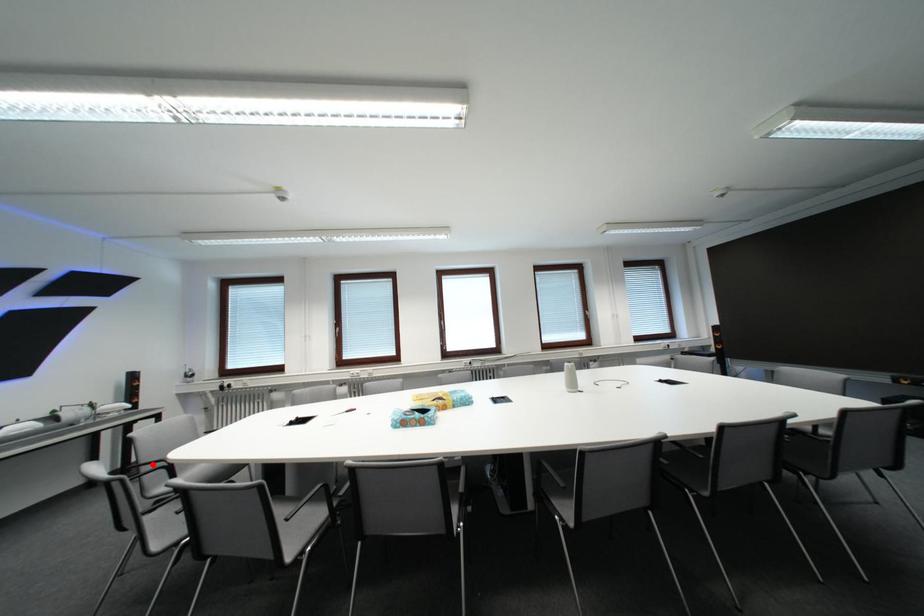
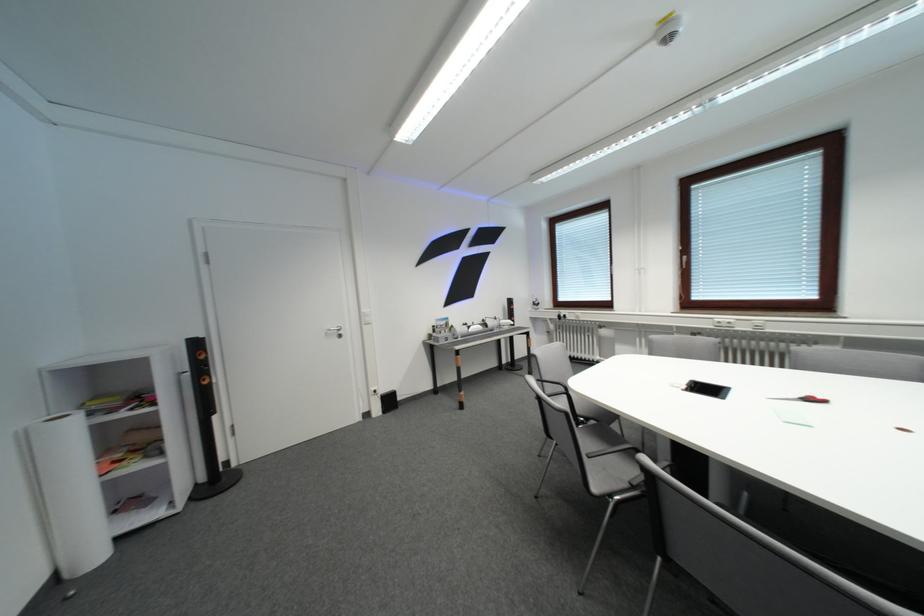
Find the pixel in the second image that matches the highlighted location in the first image.

(554, 381)